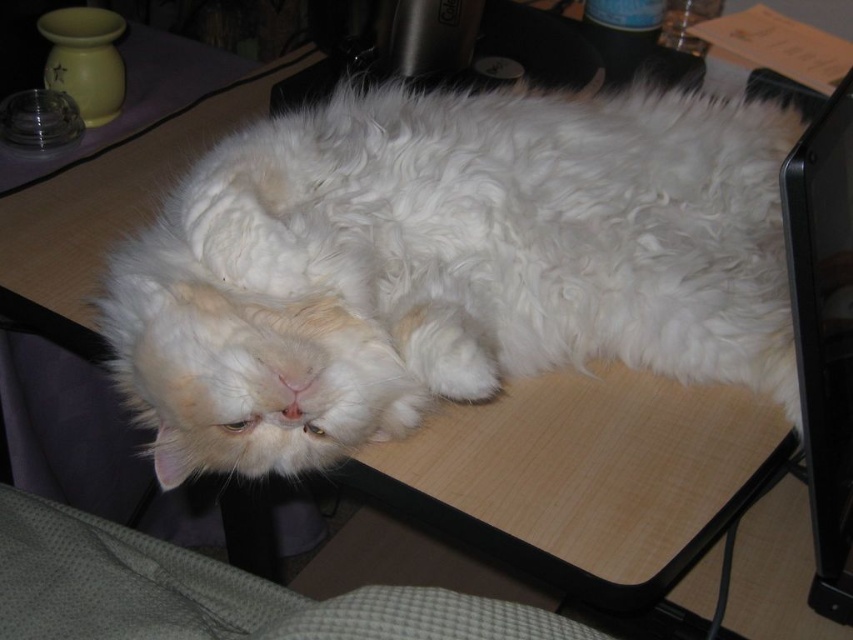
Does white fluffy cat at center have a lesser width compared to black glossy monitor at right?

In fact, white fluffy cat at center might be wider than black glossy monitor at right.

Is point (764, 154) closer to viewer compared to point (837, 576)?

No, (764, 154) is further to viewer.

Find the location of `white fluffy cat at center`. white fluffy cat at center is located at coordinates (445, 264).